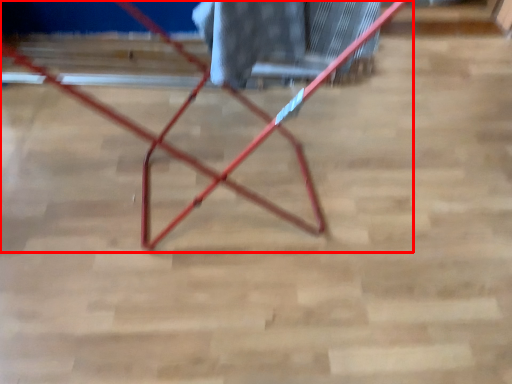
Question: In this image, where is furniture (annotated by the red box) located relative to laundry?

Choices:
 (A) left
 (B) right

Answer: (A)